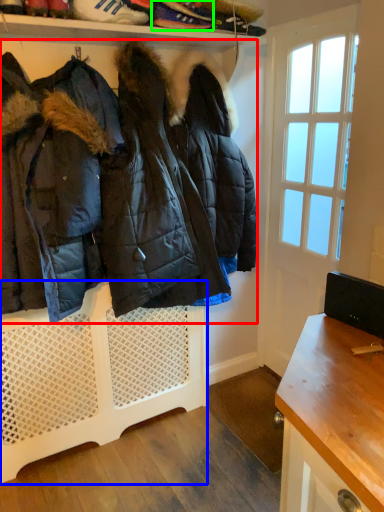
Question: Based on their relative distances, which object is nearer to jacket (highlighted by a red box)? Choose from shelf (highlighted by a blue box) and footwear (highlighted by a green box).

Choices:
 (A) shelf
 (B) footwear

Answer: (A)